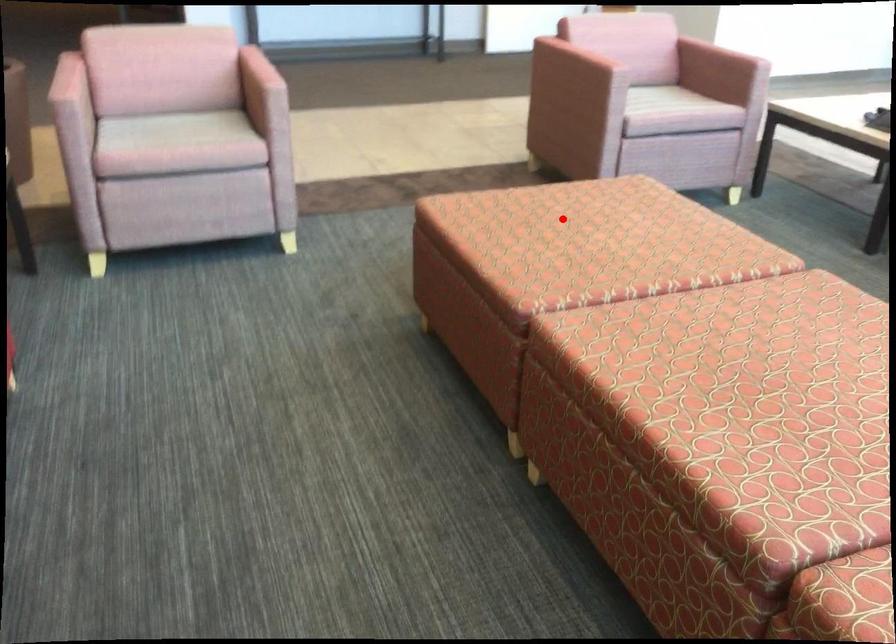
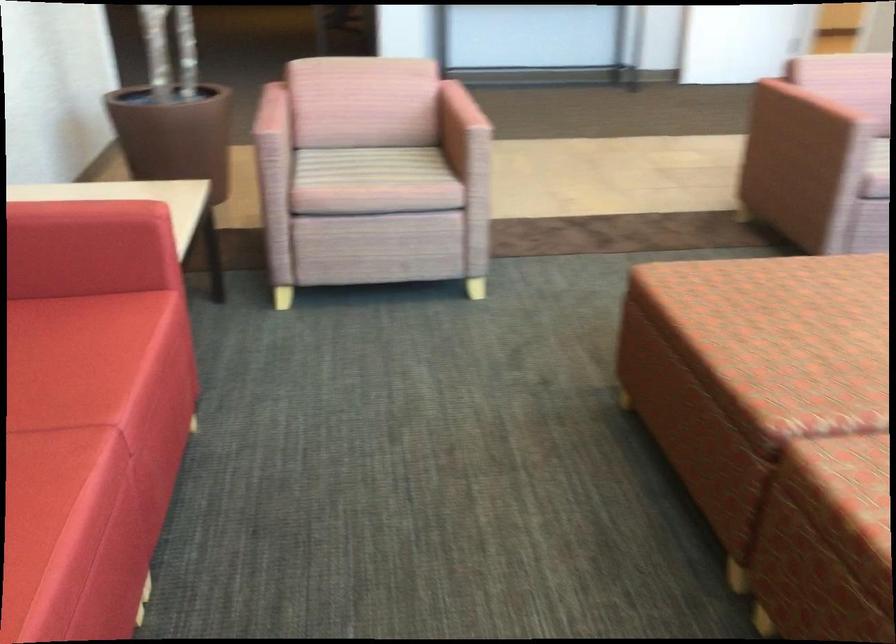
Question: I am providing you with two images of the same scene from different viewpoints. Image1 has a red point marked. In image2, the corresponding 3D location appears at what relative position? Reply with the corresponding letter.

Choices:
 (A) Closer
 (B) Farther

Answer: (A)